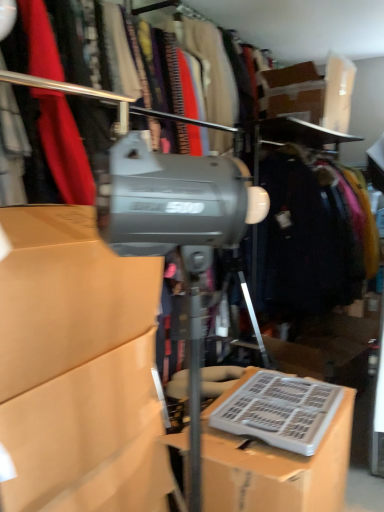
Question: Is white plastic keyboard at lower right bigger or smaller than matte cardboard box at center, which is the second box from right to left?

Choices:
 (A) big
 (B) small

Answer: (B)

Question: Considering the positions of white plastic keyboard at lower right and matte cardboard box at center, which is the second box from right to left, in the image, is white plastic keyboard at lower right wider or thinner than matte cardboard box at center, which is the second box from right to left,?

Choices:
 (A) wide
 (B) thin

Answer: (A)

Question: Considering the real-world distances, which object is closest to the dark blue fabric coat at right?

Choices:
 (A) matte gray tripod at center
 (B) matte cardboard box at center, which is counted as the first box, starting from the left
 (C) white plastic keyboard at lower right
 (D) cardboard box at center, which is the second box from left to right

Answer: (C)

Question: Which is nearer to the cardboard box at center, which appears as the first box when viewed from the right?

Choices:
 (A) matte gray tripod at center
 (B) matte cardboard box at center, which is the second box from right to left
 (C) dark blue fabric coat at right
 (D) white plastic keyboard at lower right

Answer: (D)